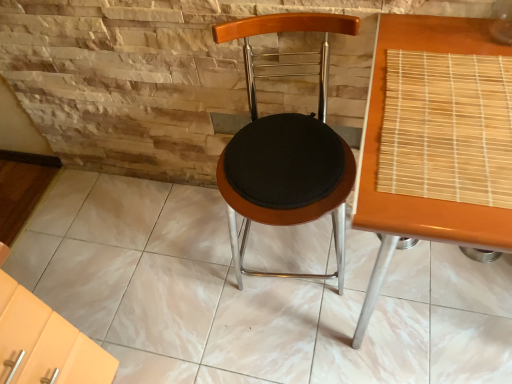
The image size is (512, 384). Find the location of `bamboo mat at right`. bamboo mat at right is located at coordinates (447, 128).

What are the coordinates of `wooden bamboo mat at right` in the screenshot? It's located at (412, 196).

From a real-world perspective, who is located higher, woodenseat cushion at center or bamboo mat at right?

bamboo mat at right is physically above.

Who is taller, woodenseat cushion at center or bamboo mat at right?

woodenseat cushion at center is taller.

From the image's perspective, which object appears higher, woodenseat cushion at center or bamboo mat at right?

bamboo mat at right.

From a real-world perspective, is woodenseat cushion at center located beneath wooden bamboo mat at right?

Incorrect, from a real-world perspective, woodenseat cushion at center is higher than wooden bamboo mat at right.

How much distance is there between woodenseat cushion at center and wooden bamboo mat at right?

They are 14.18 inches apart.

Considering the sizes of objects woodenseat cushion at center and wooden bamboo mat at right in the image provided, who is taller, woodenseat cushion at center or wooden bamboo mat at right?

woodenseat cushion at center.

Can we say woodenseat cushion at center lies outside wooden bamboo mat at right?

Yes, woodenseat cushion at center is not within wooden bamboo mat at right.

Is wooden bamboo mat at right situated inside bamboo mat at right or outside?

wooden bamboo mat at right is not enclosed by bamboo mat at right.

Does wooden bamboo mat at right have a lesser height compared to bamboo mat at right?

No, wooden bamboo mat at right is not shorter than bamboo mat at right.

From the image's perspective, between wooden bamboo mat at right and bamboo mat at right, which one is located above?

From the image's view, bamboo mat at right is above.

Considering the sizes of wooden bamboo mat at right and bamboo mat at right in the image, is wooden bamboo mat at right bigger or smaller than bamboo mat at right?

In the image, wooden bamboo mat at right appears to be larger than bamboo mat at right.

From a real-world perspective, is bamboo mat at right positioned under woodenseat cushion at center based on gravity?

Incorrect, from a real-world perspective, bamboo mat at right is higher than woodenseat cushion at center.

Is bamboo mat at right next to woodenseat cushion at center and touching it?

There is a gap between bamboo mat at right and woodenseat cushion at center.

Can you confirm if bamboo mat at right is taller than woodenseat cushion at center?

No, bamboo mat at right is not taller than woodenseat cushion at center.

Considering their positions, is wooden bamboo mat at right located in front of or behind woodenseat cushion at center?

Visually, wooden bamboo mat at right is located in front of woodenseat cushion at center.

This screenshot has height=384, width=512. Identify the location of table in front of the woodenseat cushion at center. (412, 196).

From the image's perspective, is wooden bamboo mat at right above woodenseat cushion at center?

Incorrect, from the image's perspective, wooden bamboo mat at right is lower than woodenseat cushion at center.

What's the angular difference between wooden bamboo mat at right and woodenseat cushion at center's facing directions?

wooden bamboo mat at right and woodenseat cushion at center are facing 7.08 degrees away from each other.

Can you see bamboo mat at right touching wooden bamboo mat at right?

Yes, the surface of bamboo mat at right is in contact with wooden bamboo mat at right.

Identify the location of mat above the wooden bamboo mat at right (from the image's perspective). (447, 128).

Is bamboo mat at right in front of or behind wooden bamboo mat at right in the image?

Visually, bamboo mat at right is located behind wooden bamboo mat at right.

In the scene shown: Does bamboo mat at right have a greater height compared to wooden bamboo mat at right?

No.

Locate an element on the screen. The width and height of the screenshot is (512, 384). mat located above the woodenseat cushion at center (from a real-world perspective) is located at coordinates (447, 128).

You are a GUI agent. You are given a task and a screenshot of the screen. Output one action in this format:
    pyautogui.click(x=<x>, y=<y>)
    Task: Click on the chair behind the wooden bamboo mat at right
    
    Given the screenshot: What is the action you would take?
    pyautogui.click(x=286, y=151)

From the image, which object appears to be farther from bamboo mat at right, wooden bamboo mat at right or woodenseat cushion at center?

woodenseat cushion at center is positioned further to the anchor bamboo mat at right.

Based on their spatial positions, is bamboo mat at right or woodenseat cushion at center closer to wooden bamboo mat at right?

bamboo mat at right.

Considering their positions, is wooden bamboo mat at right positioned further to woodenseat cushion at center than bamboo mat at right?

bamboo mat at right is further to woodenseat cushion at center.

When comparing their distances from wooden bamboo mat at right, does woodenseat cushion at center or bamboo mat at right seem further?

Based on the image, woodenseat cushion at center appears to be further to wooden bamboo mat at right.

From the image, which object appears to be farther from bamboo mat at right, woodenseat cushion at center or wooden bamboo mat at right?

woodenseat cushion at center lies further to bamboo mat at right than the other object.

Considering their positions, is bamboo mat at right positioned further to woodenseat cushion at center than wooden bamboo mat at right?

bamboo mat at right is further to woodenseat cushion at center.

Where is `mat between woodenseat cushion at center and wooden bamboo mat at right from left to right`? This screenshot has height=384, width=512. mat between woodenseat cushion at center and wooden bamboo mat at right from left to right is located at coordinates (447, 128).